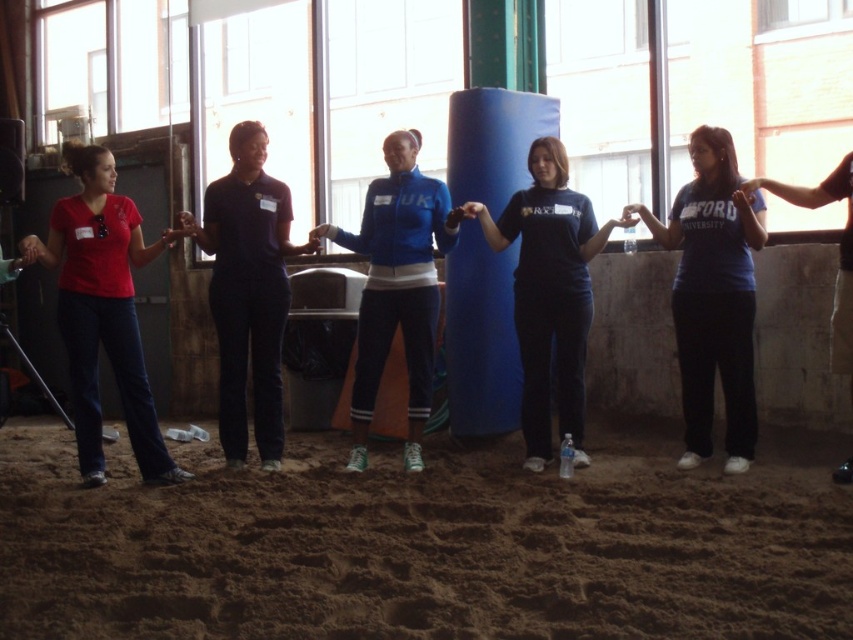
Between point (514, 285) and point (190, 225), which one is positioned in front?

Point (190, 225)

Between dark blue t-shirt at center and matte black hand at center, which one is positioned higher?

matte black hand at center is higher up.

Describe the element at coordinates (549, 292) in the screenshot. I see `dark blue t-shirt at center` at that location.

Image resolution: width=853 pixels, height=640 pixels. Find the location of `dark blue t-shirt at center`. dark blue t-shirt at center is located at coordinates (549, 292).

Is the position of dark blue t-shirt at center less distant than that of matte blue jacket at center?

Yes, it is in front of matte blue jacket at center.

Does point (566, 387) come in front of point (323, 225)?

Yes, it is.

This screenshot has height=640, width=853. I want to click on dark blue t-shirt at center, so click(x=549, y=292).

Describe the element at coordinates (398, 288) in the screenshot. The width and height of the screenshot is (853, 640). I see `blue matte jacket at center` at that location.

Which is above, blue matte jacket at center or matte blue jacket at center?

matte blue jacket at center is above.

Does point (422, 385) come in front of point (325, 234)?

That is True.

This screenshot has width=853, height=640. What are the coordinates of `blue matte jacket at center` in the screenshot? It's located at (398, 288).